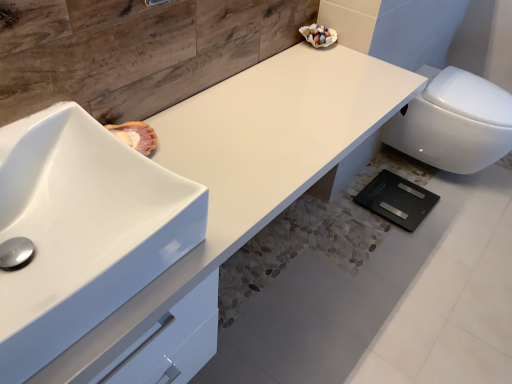
Question: Does point (292, 119) appear closer or farther from the camera than point (457, 137)?

Choices:
 (A) farther
 (B) closer

Answer: (B)

Question: Considering the positions of white glossy counter top at center and white glossy toilet at lower right in the image, is white glossy counter top at center taller or shorter than white glossy toilet at lower right?

Choices:
 (A) tall
 (B) short

Answer: (A)

Question: Which object is positioned farthest from the white glossy counter top at center?

Choices:
 (A) white glossy sink at left
 (B) white glossy toilet at lower right

Answer: (B)

Question: Which object is positioned farthest from the white glossy toilet at lower right?

Choices:
 (A) white glossy sink at left
 (B) white glossy counter top at center

Answer: (A)